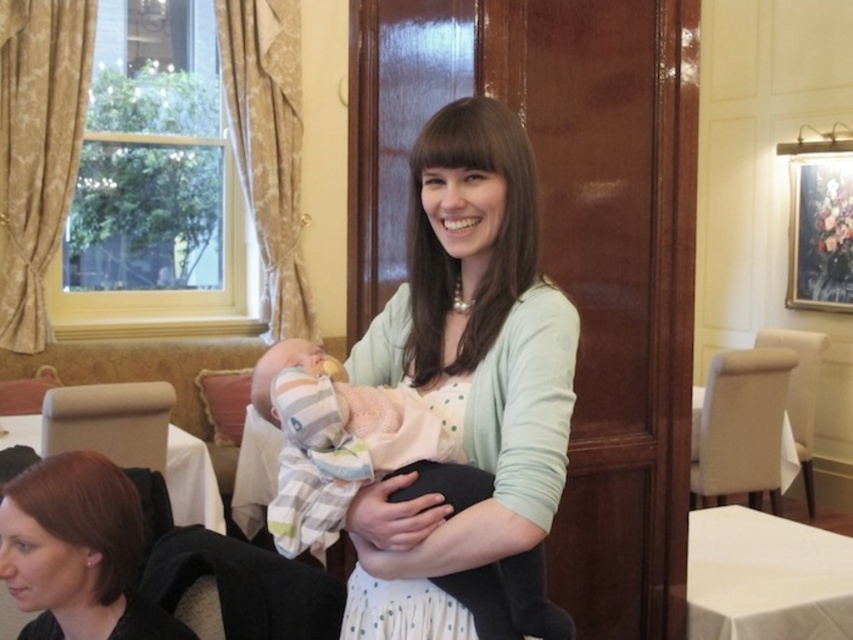
You are a photographer setting up for an event in this room. You need to place a 1.2 meter tall stand between the light green cardigan at center and the white cloth at lower right. Can the stand fit vertically between them?

The light green cardigan at center is taller than the white cloth at lower right. Since the stand is 1.2 meters tall, it can only fit vertically if there is enough vertical space between them. However, the description only provides their relative heights, not the distance between them. Therefore, we cannot determine if the stand will fit based on the given information.

You are a photographer setting up for an event. You need to position a small light between the smooth black hair at lower left and the white cloth at lower right. Based on their heights, which object should the light be placed closer to?

The smooth black hair at lower left is taller than the white cloth at lower right, so the light should be placed closer to the white cloth at lower right to ensure even illumination.

You are a delivery person carrying a large package that is 1.5 meters wide. You need to pass between the light green cardigan at center and the white cloth at lower right to reach the door. Can you fit through the space between them?

The distance between the light green cardigan at center and the white cloth at lower right is 1.51 meters. Since your package is 1.5 meters wide, you can just barely fit through the space as there is enough clearance.